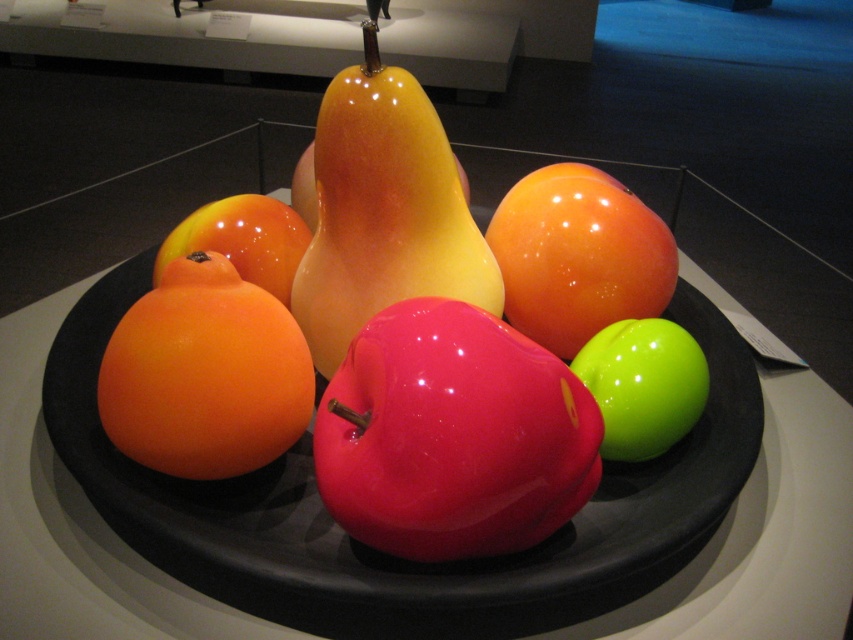
You are an art curator examining the exhibit. You need to place a protective cover over the glossy red apple at center and the glossy yellow pear at center. Which fruit should you cover first if you want to start with the one closer to you?

The glossy red apple at center is closer to the viewer than the glossy yellow pear at center, so you should cover the glossy red apple at center first.

You are an artist standing at the entrance of the gallery. You want to sketch the glossy red apple at center. Where should you position yourself to get the best view of it?

The glossy red apple at center is located at point [451,435], so you should position yourself directly in front of it to capture its detailed reflections and vibrant color accurately.

You are an art curator examining the exhibit. You need to place a small label next to the glossy orange at center. The label must be placed exactly at point (x=206, y=374). Where should you position the label?

The glossy orange at center is located exactly at point (x=206, y=374), so the label should be placed there.